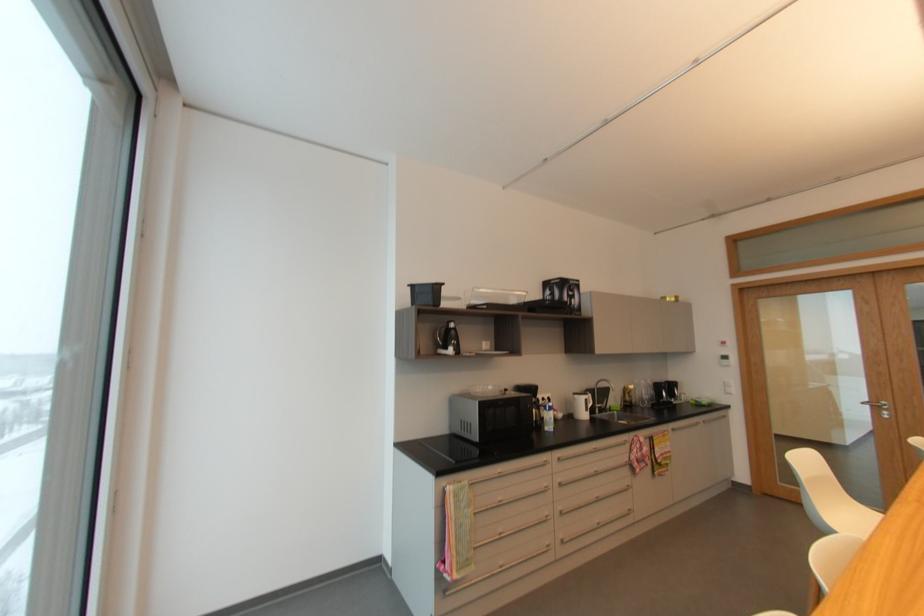
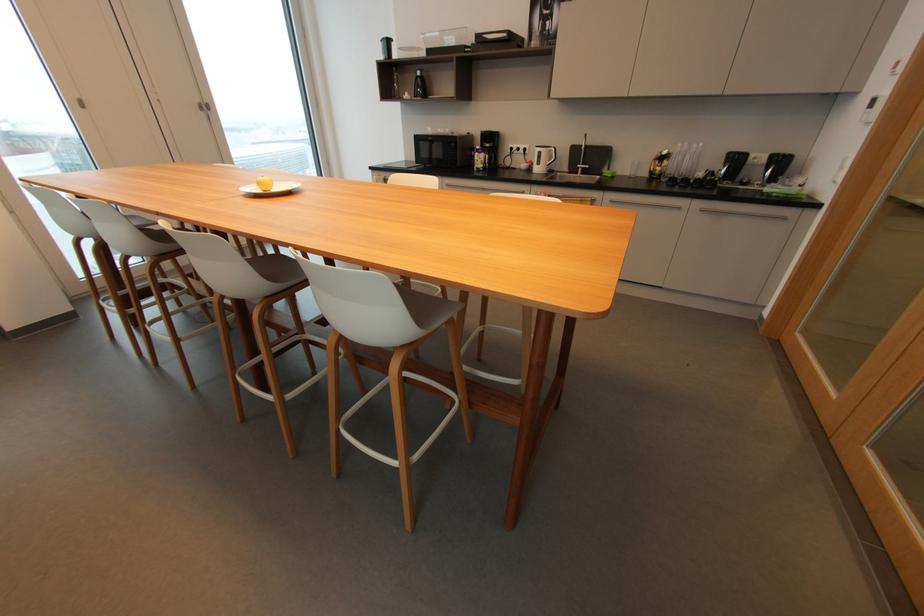
Find the pixel in the second image that matches point (456, 323) in the first image.

(421, 74)